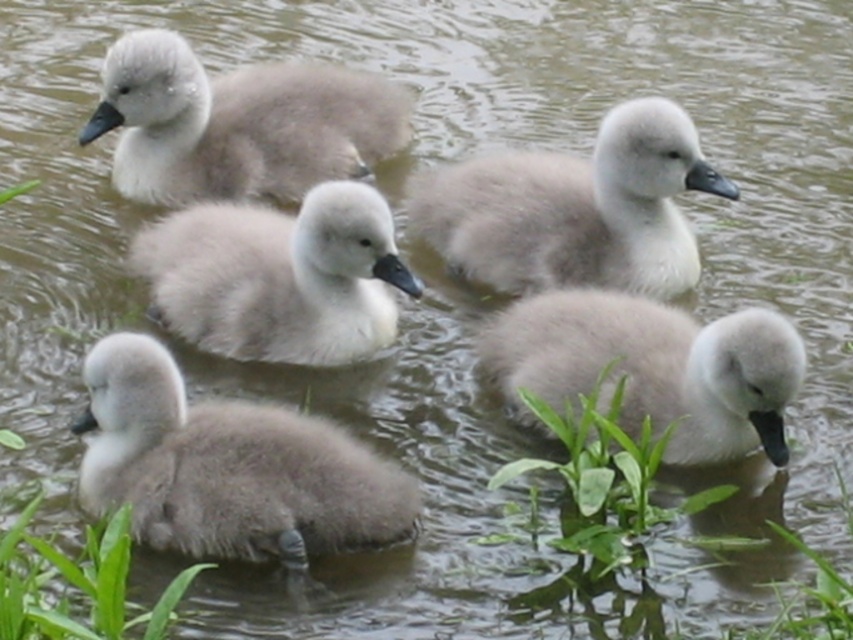
You are a photographer trying to capture the cygnets in the water. You notice two points marked on your camera screen at coordinates point (216,429) and point (10,532). Which point should you focus on to ensure the cygnets in the foreground are sharp?

You should focus on point (216,429) because it is further to the camera than point (10,532), ensuring the foreground cygnets are in focus.

You are standing on the edge of the water and see the gray fluffy swan at lower left and the green leafy grass at lower left. Which object is closer to you?

The gray fluffy swan at lower left is closer to you because it is further to the viewer than the green leafy grass at lower left.